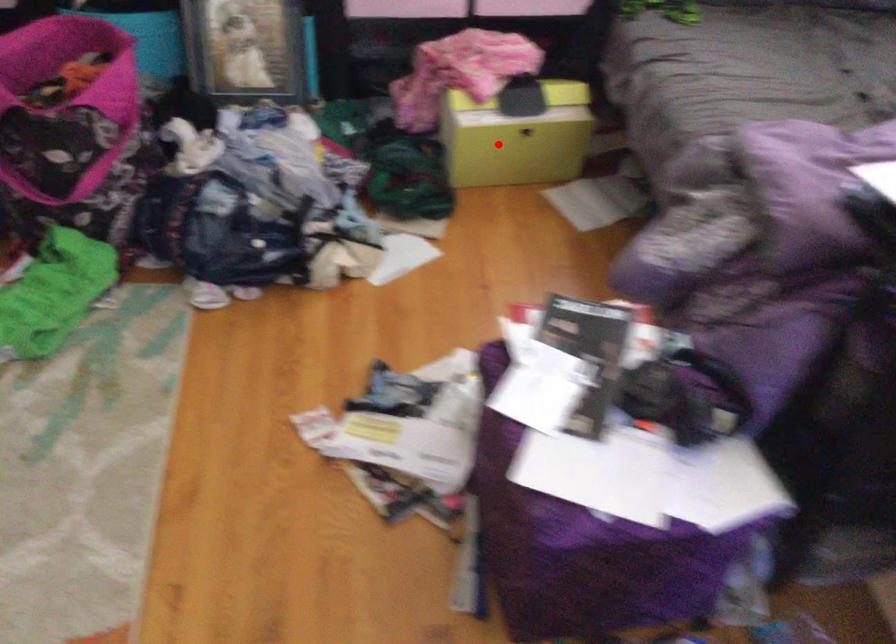
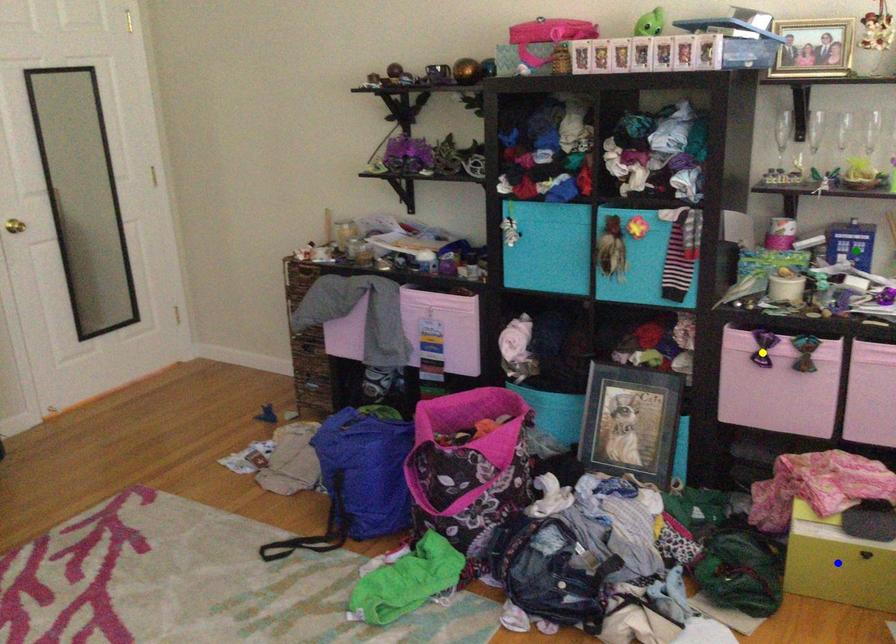
Question: I am providing you with two images of the same scene from different viewpoints. A red point is marked on the first image. You are given multiple points on the second image. Which point in image 2 is actually the same real-world point as the red point in image 1?

Choices:
 (A) green point
 (B) yellow point
 (C) blue point

Answer: (C)